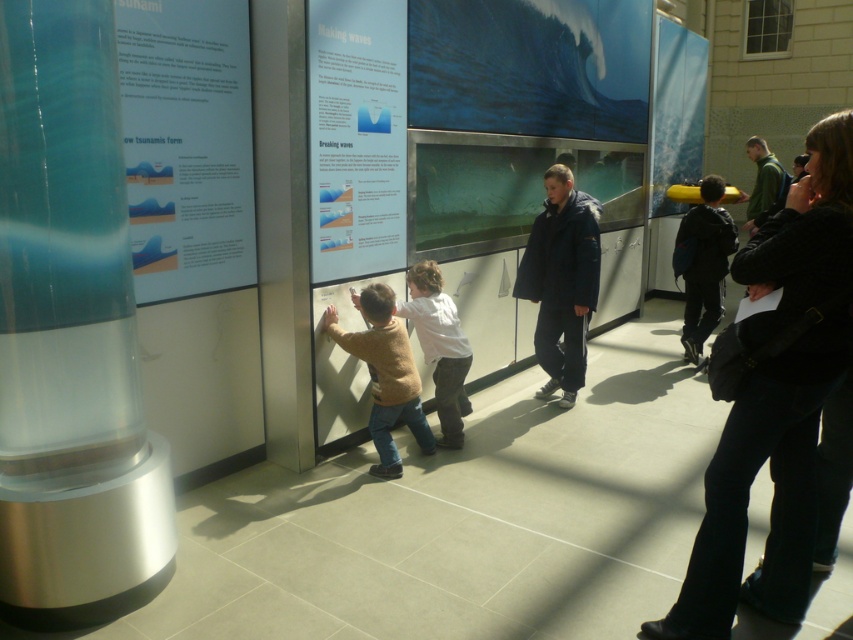
Question: Which of these objects is positioned farthest from the tan sweater at center?

Choices:
 (A) transparent glass cylinder at left
 (B) white cotton shirt at center

Answer: (A)

Question: Considering the relative positions of dark blue jacket at center and dark blue jacket at right in the image provided, where is dark blue jacket at center located with respect to dark blue jacket at right?

Choices:
 (A) below
 (B) above

Answer: (A)

Question: Among these objects, which one is farthest from the camera?

Choices:
 (A) white paper at center
 (B) white cotton shirt at center
 (C) dark blue jacket at right
 (D) dark blue jacket at center

Answer: (C)

Question: Which of the following is the closest to the observer?

Choices:
 (A) green matte jacket at upper right
 (B) white paper at center
 (C) transparent glass cylinder at left
 (D) dark blue jacket at center

Answer: (D)

Question: Does tan sweater at center have a greater width compared to dark blue jacket at right?

Choices:
 (A) yes
 (B) no

Answer: (A)

Question: Does transparent glass cylinder at left appear under white paper at center?

Choices:
 (A) no
 (B) yes

Answer: (B)